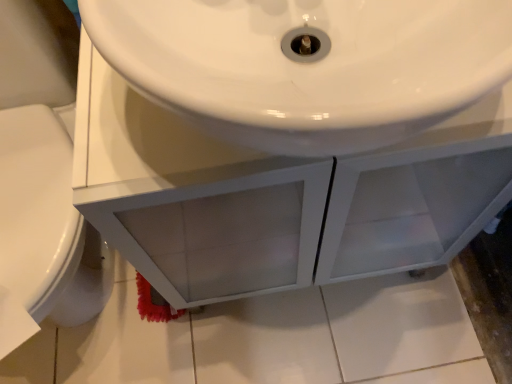
Question: Should I look upward or downward to see white glossy sink at center?

Choices:
 (A) up
 (B) down

Answer: (A)